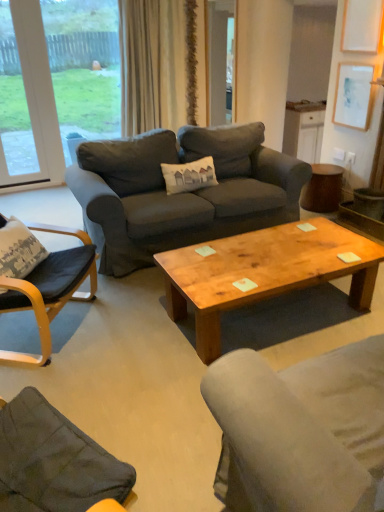
Question: Does white paper at upper right have a smaller size compared to white plastic window at upper left, acting as the 1th window starting from the left?

Choices:
 (A) yes
 (B) no

Answer: (A)

Question: From the image's perspective, is white paper at upper right above white plastic window at upper left, acting as the 1th window starting from the left?

Choices:
 (A) no
 (B) yes

Answer: (A)

Question: Considering the relative sizes of white paper at upper right and white plastic window at upper left, acting as the 1th window starting from the left, in the image provided, is white paper at upper right bigger than white plastic window at upper left, acting as the 1th window starting from the left,?

Choices:
 (A) yes
 (B) no

Answer: (B)

Question: Is white paper at upper right to the right of white plastic window at upper left, acting as the 1th window starting from the left, from the viewer's perspective?

Choices:
 (A) no
 (B) yes

Answer: (B)

Question: From the image's perspective, does white paper at upper right appear lower than white plastic window at upper left, acting as the 1th window starting from the left?

Choices:
 (A) no
 (B) yes

Answer: (B)

Question: Relative to beige fabric curtain at upper center, is wooden coffee table at center in front or behind?

Choices:
 (A) behind
 (B) front

Answer: (B)

Question: From the image's perspective, is wooden coffee table at center above or below beige fabric curtain at upper center?

Choices:
 (A) above
 (B) below

Answer: (B)

Question: From their relative heights in the image, would you say wooden coffee table at center is taller or shorter than beige fabric curtain at upper center?

Choices:
 (A) short
 (B) tall

Answer: (A)

Question: In the image, is wooden coffee table at center on the left side or the right side of beige fabric curtain at upper center?

Choices:
 (A) right
 (B) left

Answer: (A)

Question: Looking at the image, does white plastic window at upper left, marked as the 2th window in a right-to-left arrangement, seem bigger or smaller compared to wooden coffee table at center?

Choices:
 (A) small
 (B) big

Answer: (A)

Question: Looking at their shapes, would you say white plastic window at upper left, acting as the 1th window starting from the left, is wider or thinner than wooden coffee table at center?

Choices:
 (A) wide
 (B) thin

Answer: (B)

Question: Would you say white plastic window at upper left, acting as the 1th window starting from the left, is inside or outside wooden coffee table at center?

Choices:
 (A) inside
 (B) outside

Answer: (B)

Question: From a real-world perspective, is white plastic window at upper left, marked as the 2th window in a right-to-left arrangement, above or below wooden coffee table at center?

Choices:
 (A) below
 (B) above

Answer: (B)

Question: Looking at their shapes, would you say black leather chair at left is wider or thinner than dark gray fabric couch at center?

Choices:
 (A) wide
 (B) thin

Answer: (B)

Question: In terms of height, does black leather chair at left look taller or shorter compared to dark gray fabric couch at center?

Choices:
 (A) short
 (B) tall

Answer: (B)